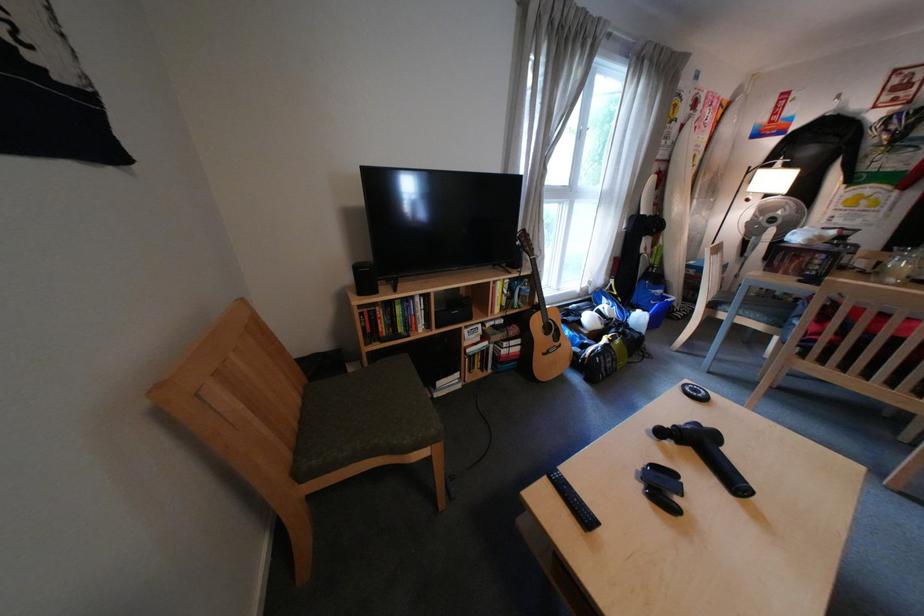
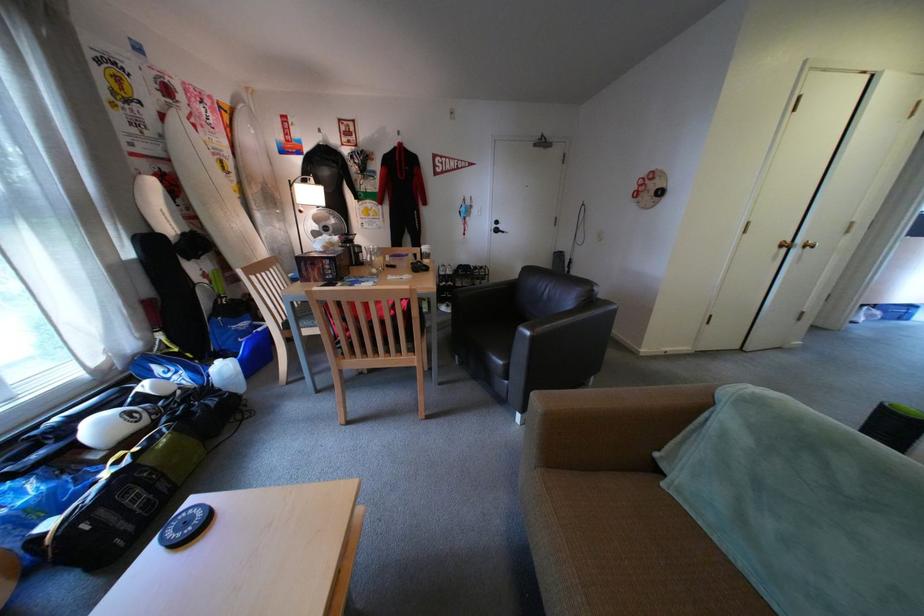
In the second image, find the point that corresponds to point 793,276 in the first image.

(325, 285)